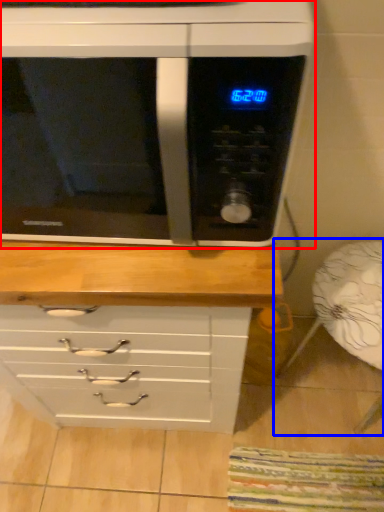
Question: Which of the following is the closest to the observer, microwave oven (highlighted by a red box) or armchair (highlighted by a blue box)?

Choices:
 (A) microwave oven
 (B) armchair

Answer: (A)